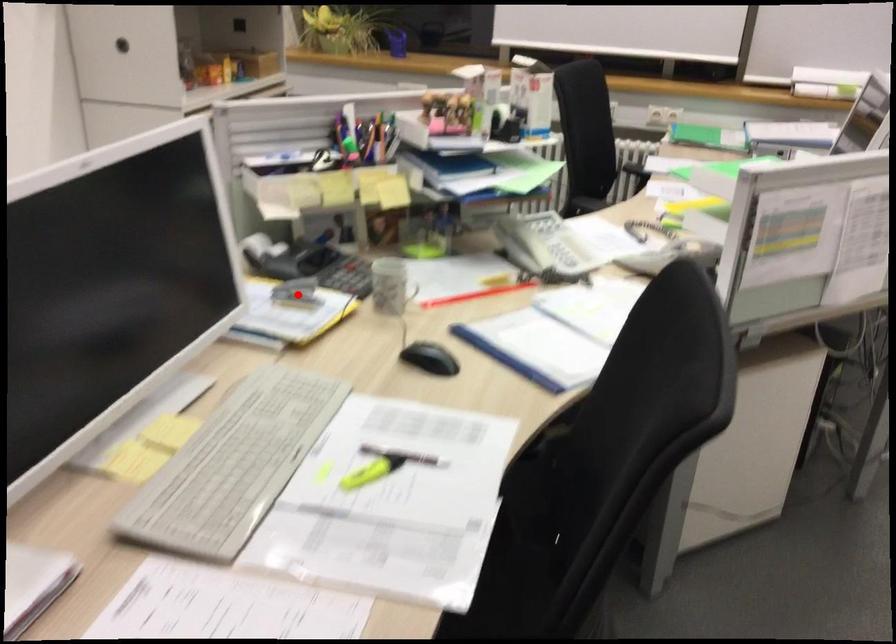
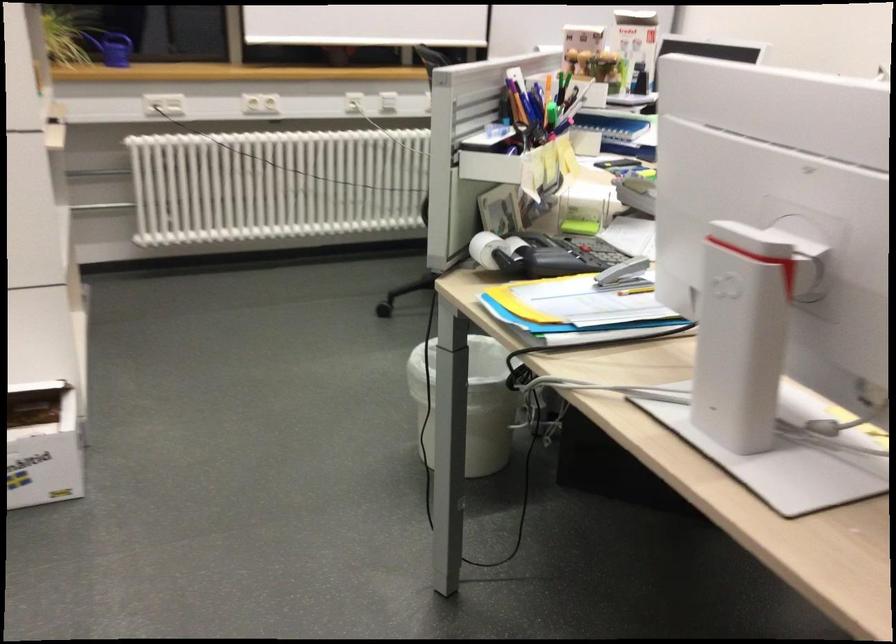
Where in the second image is the point corresponding to the highlighted location from the first image?

(624, 275)